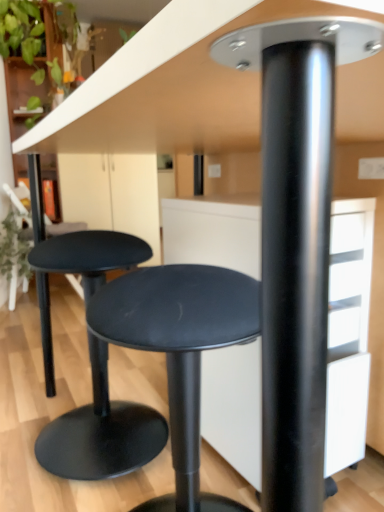
Question: Is matte black stool at center, the first stool when ordered from front to back, shorter than matte black stool at lower left, positioned as the second stool in front-to-back order?

Choices:
 (A) yes
 (B) no

Answer: (A)

Question: Is matte black stool at center, the first stool when ordered from front to back, at the left side of matte black stool at lower left, which appears as the first stool when viewed from the back?

Choices:
 (A) no
 (B) yes

Answer: (A)

Question: Is matte black stool at center, which is the 2th stool from back to front, bigger than matte black stool at lower left, which appears as the first stool when viewed from the back?

Choices:
 (A) yes
 (B) no

Answer: (B)

Question: From a real-world perspective, is matte black stool at center, which is the 2th stool from back to front, below matte black stool at lower left, positioned as the second stool in front-to-back order?

Choices:
 (A) no
 (B) yes

Answer: (B)

Question: Considering the relative sizes of matte black stool at center, which is the 2th stool from back to front, and matte black stool at lower left, positioned as the second stool in front-to-back order, in the image provided, is matte black stool at center, which is the 2th stool from back to front, smaller than matte black stool at lower left, positioned as the second stool in front-to-back order,?

Choices:
 (A) yes
 (B) no

Answer: (A)

Question: From the image's perspective, is matte black stool at center, which is the 2th stool from back to front, located beneath matte black stool at lower left, which appears as the first stool when viewed from the back?

Choices:
 (A) no
 (B) yes

Answer: (B)

Question: From a real-world perspective, is matte black stool at lower left, positioned as the second stool in front-to-back order, below matte black stool at center, the first stool when ordered from front to back?

Choices:
 (A) no
 (B) yes

Answer: (A)

Question: Is matte black stool at lower left, which appears as the first stool when viewed from the back, positioned before matte black stool at center, the first stool when ordered from front to back?

Choices:
 (A) yes
 (B) no

Answer: (B)

Question: Could matte black stool at center, the first stool when ordered from front to back, be considered to be inside matte black stool at lower left, positioned as the second stool in front-to-back order?

Choices:
 (A) yes
 (B) no

Answer: (B)

Question: From the image's perspective, is matte black stool at lower left, which appears as the first stool when viewed from the back, beneath matte black stool at center, which is the 2th stool from back to front?

Choices:
 (A) no
 (B) yes

Answer: (A)

Question: From the image's perspective, is matte black stool at lower left, which appears as the first stool when viewed from the back, on matte black stool at center, the first stool when ordered from front to back?

Choices:
 (A) yes
 (B) no

Answer: (A)

Question: Does matte black stool at lower left, positioned as the second stool in front-to-back order, appear on the right side of matte black stool at center, which is the 2th stool from back to front?

Choices:
 (A) yes
 (B) no

Answer: (B)

Question: Considering the positions of matte black stool at lower left, which appears as the first stool when viewed from the back, and matte black stool at center, the first stool when ordered from front to back, in the image, is matte black stool at lower left, which appears as the first stool when viewed from the back, wider or thinner than matte black stool at center, the first stool when ordered from front to back,?

Choices:
 (A) wide
 (B) thin

Answer: (B)